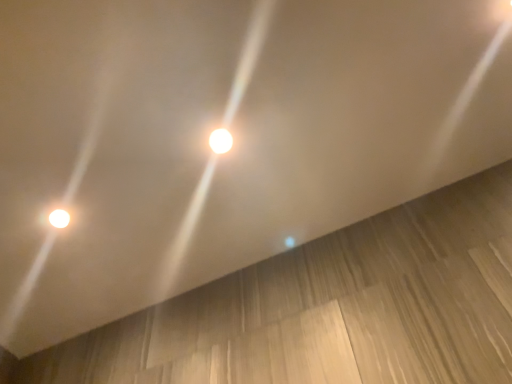
Question: Does white glossy light at center, the second lamp viewed from the back, appear on the left side of light brown wood at lower right?

Choices:
 (A) no
 (B) yes

Answer: (A)

Question: Is white glossy light at center, the second lamp viewed from the back, wider than light brown wood at lower right?

Choices:
 (A) yes
 (B) no

Answer: (B)

Question: Is light brown wood at lower right a part of white glossy light at center, the second lamp viewed from the back?

Choices:
 (A) no
 (B) yes

Answer: (A)

Question: Does white glossy light at center, the second lamp in the bottom-to-top sequence, come in front of light brown wood at lower right?

Choices:
 (A) no
 (B) yes

Answer: (A)

Question: From a real-world perspective, is white glossy light at center, which is the 2th lamp in left-to-right order, on light brown wood at lower right?

Choices:
 (A) yes
 (B) no

Answer: (B)

Question: Is white glossy light at center, which is the 2th lamp in left-to-right order, oriented away from light brown wood at lower right?

Choices:
 (A) no
 (B) yes

Answer: (B)

Question: Is light brown wood at lower right smaller than matte white lamp at lower left, the first lamp in the bottom-to-top sequence?

Choices:
 (A) no
 (B) yes

Answer: (A)

Question: Is light brown wood at lower right looking in the opposite direction of matte white lamp at lower left, which appears as the 2th lamp when viewed from the front?

Choices:
 (A) yes
 (B) no

Answer: (A)

Question: Considering the relative positions of light brown wood at lower right and matte white lamp at lower left, the first lamp in the bottom-to-top sequence, in the image provided, is light brown wood at lower right to the right of matte white lamp at lower left, the first lamp in the bottom-to-top sequence, from the viewer's perspective?

Choices:
 (A) no
 (B) yes

Answer: (B)

Question: Can you confirm if light brown wood at lower right is wider than matte white lamp at lower left, the first lamp when ordered from back to front?

Choices:
 (A) yes
 (B) no

Answer: (A)

Question: From a real-world perspective, is light brown wood at lower right positioned under matte white lamp at lower left, which appears as the 2th lamp when viewed from the front, based on gravity?

Choices:
 (A) no
 (B) yes

Answer: (A)

Question: Is light brown wood at lower right thinner than matte white lamp at lower left, the second lamp in the top-to-bottom sequence?

Choices:
 (A) no
 (B) yes

Answer: (A)

Question: Is light brown wood at lower right closer to camera compared to white glossy light at center, arranged as the first lamp when viewed from the right?

Choices:
 (A) yes
 (B) no

Answer: (A)